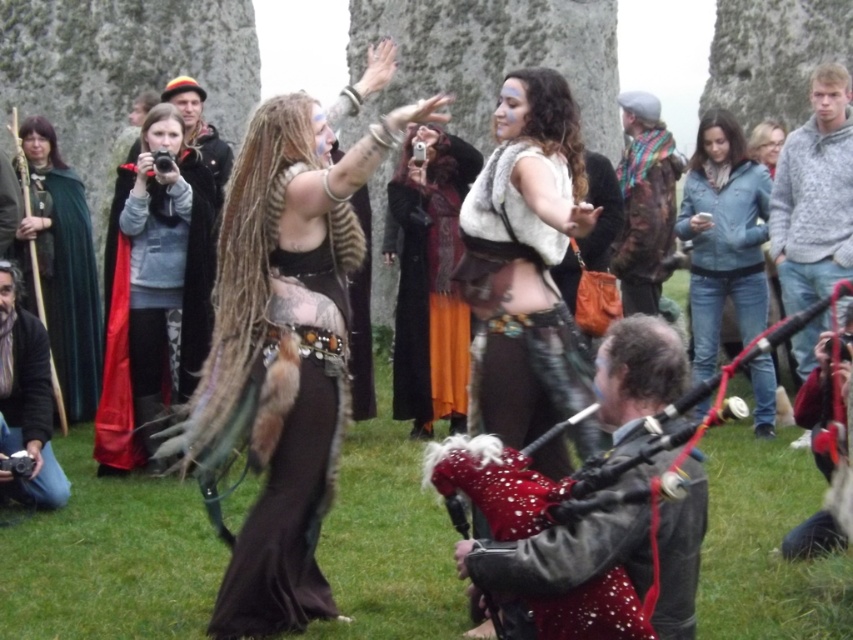
Question: Which of the following is the farthest from the observer?

Choices:
 (A) (39, 420)
 (B) (744, 312)
 (C) (634, 248)

Answer: (C)

Question: Is dark brown leather jacket at lower left to the right of camouflage jacket at center from the viewer's perspective?

Choices:
 (A) yes
 (B) no

Answer: (B)

Question: Which point appears closest to the camera in this image?

Choices:
 (A) (454, 358)
 (B) (802, 192)
 (C) (71, 378)
 (D) (689, 637)

Answer: (D)

Question: Is red velvet bagpipe at lower center positioned before orange velvet dress at center?

Choices:
 (A) yes
 (B) no

Answer: (A)

Question: Which object is closer to the camera taking this photo?

Choices:
 (A) fur-covered dress at center
 (B) velvet cape at upper left

Answer: (A)

Question: Does fur-covered dress at center appear on the right side of green velvet cape at left?

Choices:
 (A) no
 (B) yes

Answer: (B)